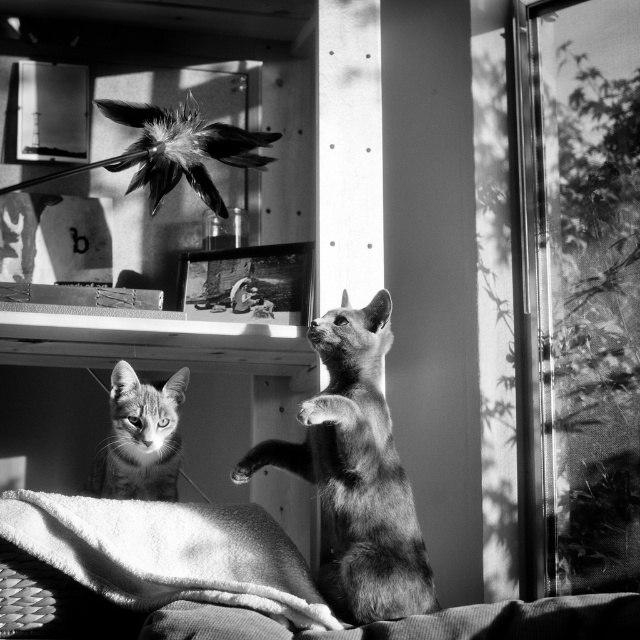
Question: Can you confirm if transparent mesh at right is positioned below tabby fur cat at lower left?

Choices:
 (A) no
 (B) yes

Answer: (A)

Question: Which of the following is the closest to the observer?

Choices:
 (A) (220, 560)
 (B) (104, 451)
 (C) (330, 493)

Answer: (A)

Question: Which point appears farthest from the camera in this image?

Choices:
 (A) (193, 531)
 (B) (161, 497)

Answer: (B)

Question: Among these points, which one is nearest to the camera?

Choices:
 (A) (36, 493)
 (B) (528, 449)

Answer: (A)

Question: Does soft white towel at lower left have a smaller size compared to tabby fur cat at lower left?

Choices:
 (A) no
 (B) yes

Answer: (A)

Question: Is soft fur cat at center to the left of soft white towel at lower left from the viewer's perspective?

Choices:
 (A) yes
 (B) no

Answer: (B)